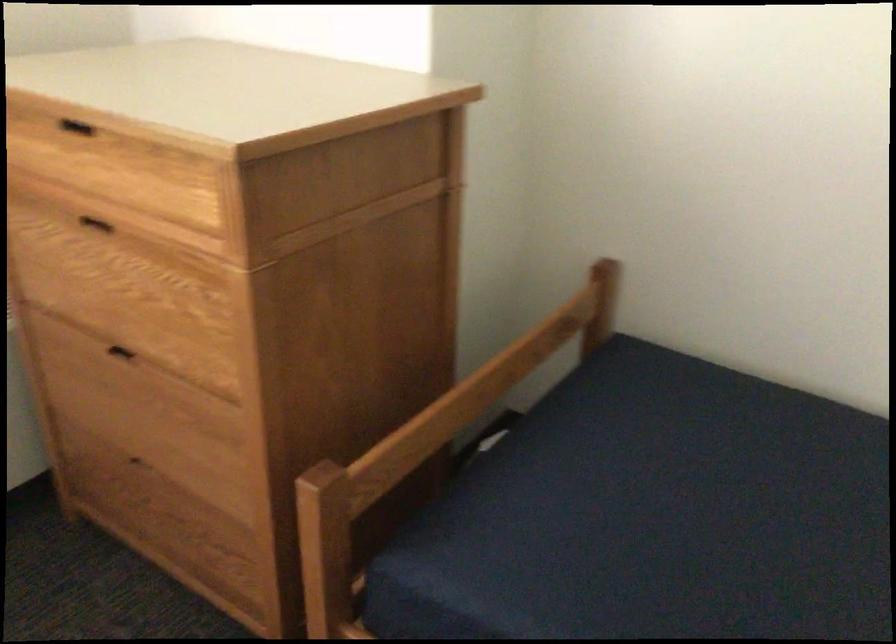
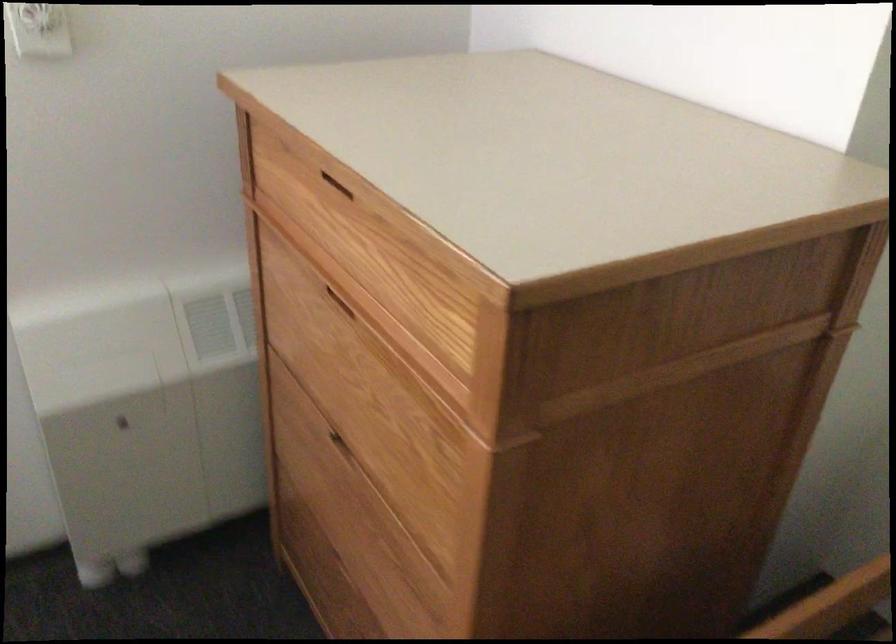
Question: Which direction would the cameraman need to move to produce the second image? Reply with the corresponding letter.

Choices:
 (A) Left
 (B) Right
 (C) Forward
 (D) Backward

Answer: (C)